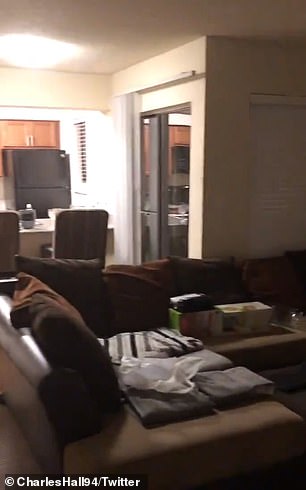
Locate an element on the screen. The image size is (306, 490). handle to open freezer is located at coordinates (68, 170).